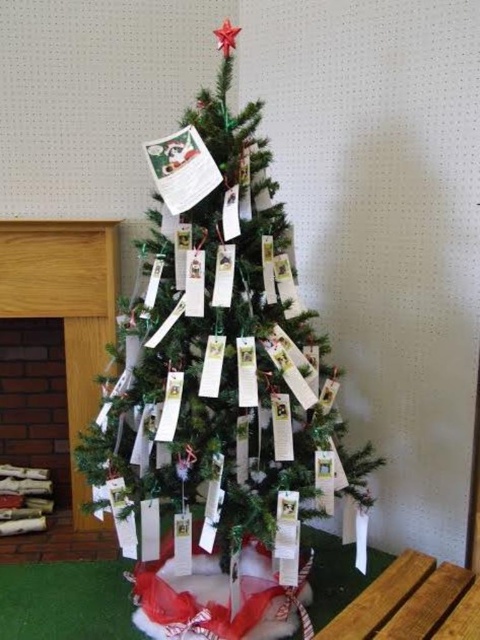
This screenshot has height=640, width=480. Describe the element at coordinates (226, 355) in the screenshot. I see `green matte christmas tree at center` at that location.

Does green matte christmas tree at center appear over white paper card at center?

No, green matte christmas tree at center is not above white paper card at center.

Describe the element at coordinates (226, 355) in the screenshot. I see `green matte christmas tree at center` at that location.

Locate an element on the screen. This screenshot has width=480, height=640. green matte christmas tree at center is located at coordinates (226, 355).